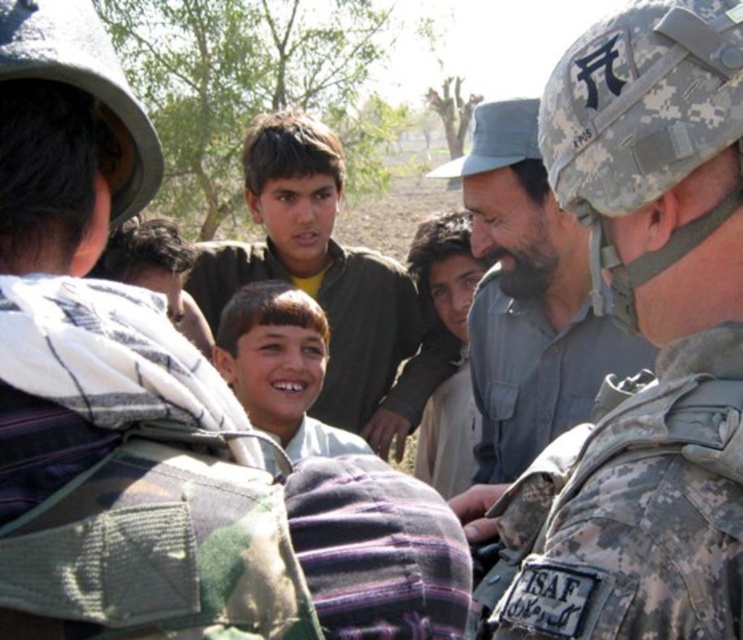
In the scene shown: You are a photographer trying to capture a group photo of the camouflage fabric military uniform at center and the smooth brown face at center. If you want to ensure both subjects are in focus, which one should you focus on first?

The camouflage fabric military uniform at center is thinner than the smooth brown face at center, so you should focus on the camouflage fabric military uniform at center first to ensure both are in focus.

From the picture: You are a photographer trying to capture a group photo of the camouflage fabric military uniform at center and the gray matte shirt at center. Which of these two subjects should you focus on first if you want to ensure the taller one is in sharp focus?

The gray matte shirt at center is taller than the camouflage fabric military uniform at center, so you should focus on the gray matte shirt at center first to ensure the taller subject is in sharp focus.

You are standing at the point marked as point (717, 586). You want to move forward to a location that is 50 inches away from your current position. Will you be able to move forward without obstacles?

The distance between point (717, 586) and the viewer is 34.70 inches. Moving forward 50 inches from point (717, 586) would exceed the available space, so you cannot move forward without obstacles.